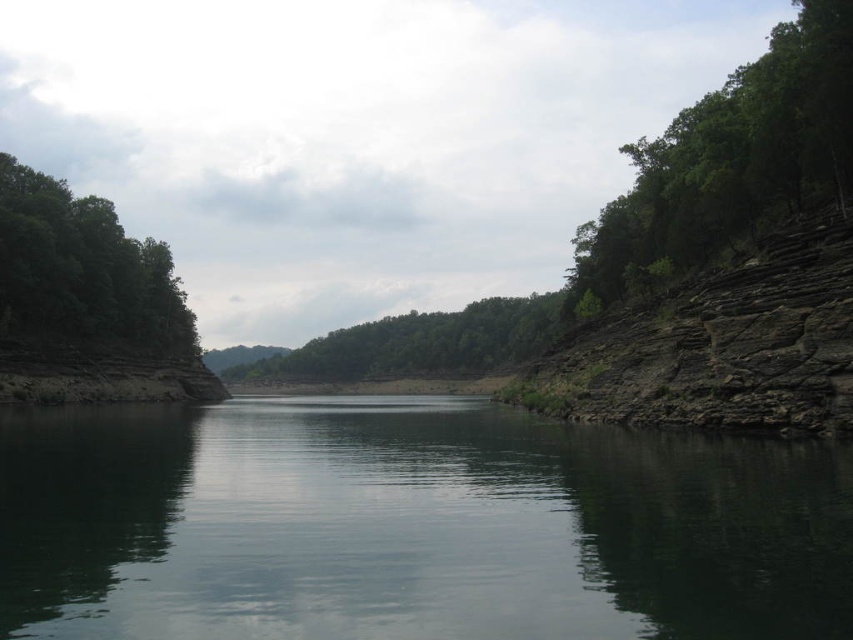
You are a hiker standing on the left bank of the lake. You see the dark green water at center and the green leafy tree at right. Which object is closer to the water surface?

The dark green water at center is below green leafy tree at right, so the dark green water at center is closer to the water surface.

You are planning to cross the dark green water at center using a small boat. There is a green leafy trees at center nearby. Which object is wider in the image?

The green leafy trees at center are wider than the dark green water at center in the image.